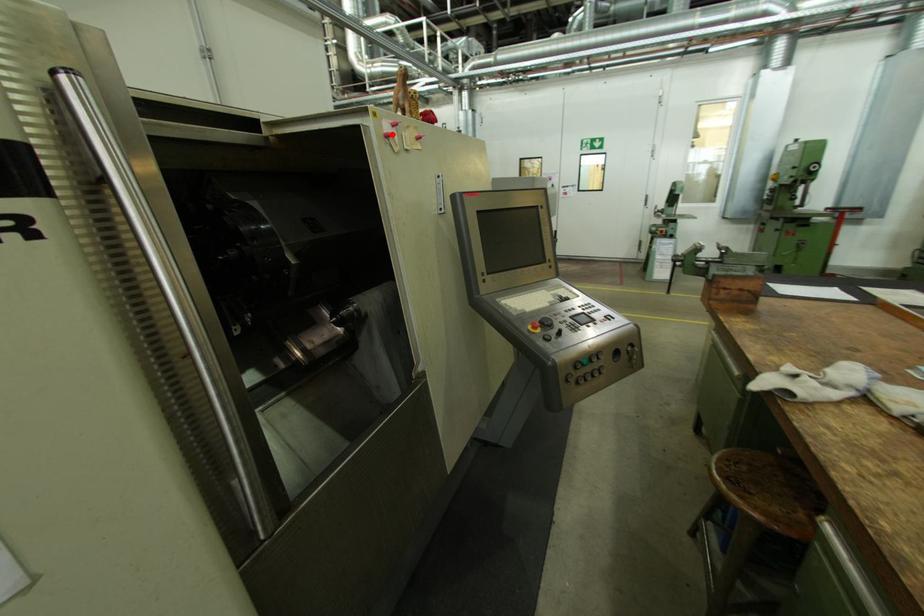
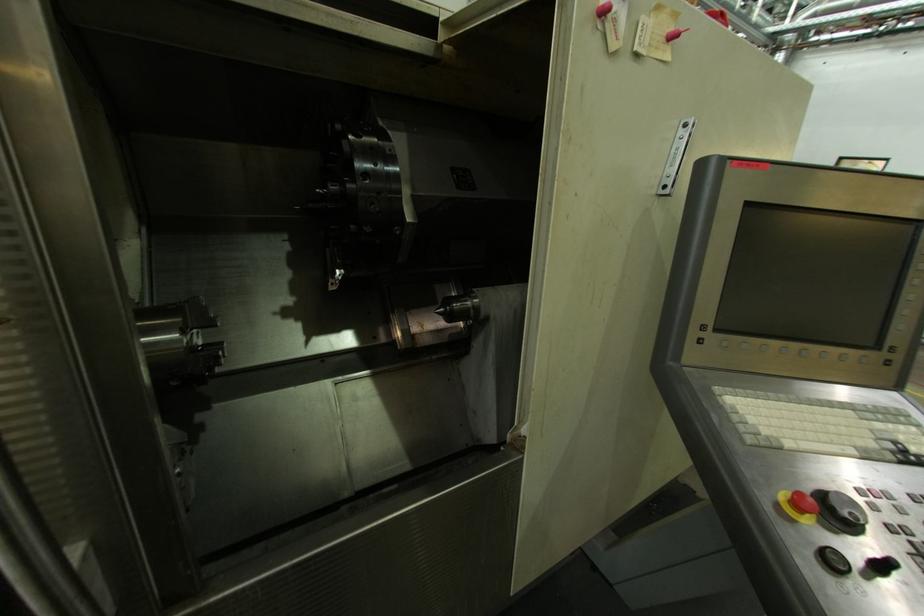
In the second image, find the point that corresponds to the highlighted location in the first image.

(608, 7)